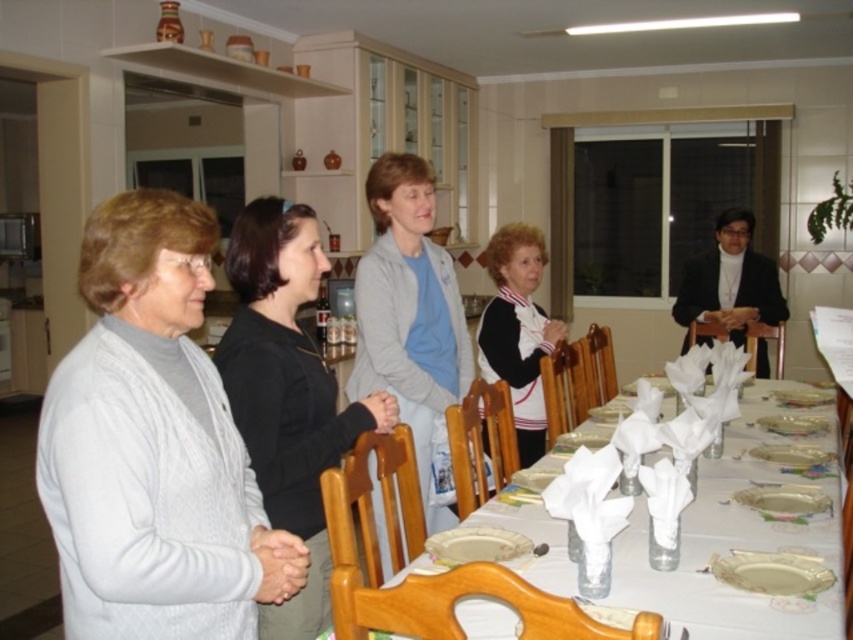
Question: Among these objects, which one is nearest to the camera?

Choices:
 (A) black and white sweater at center
 (B) white paper napkin at center

Answer: (B)

Question: Estimate the real-world distances between objects in this image. Which object is closer to the light blue sweater at center?

Choices:
 (A) white knitted sweater at left
 (B) black and white sweater at center
 (C) white paper napkin at center

Answer: (B)

Question: Is black matte sweater at center closer to camera compared to light blue sweater at center?

Choices:
 (A) yes
 (B) no

Answer: (A)

Question: Among these objects, which one is farthest from the camera?

Choices:
 (A) black and white sweater at center
 (B) light blue sweater at center
 (C) black matte sweater at center

Answer: (A)

Question: Can you confirm if black matte sweater at center is positioned to the right of black and white sweater at center?

Choices:
 (A) no
 (B) yes

Answer: (A)

Question: Is white knitted sweater at left bigger than black and white sweater at center?

Choices:
 (A) no
 (B) yes

Answer: (A)